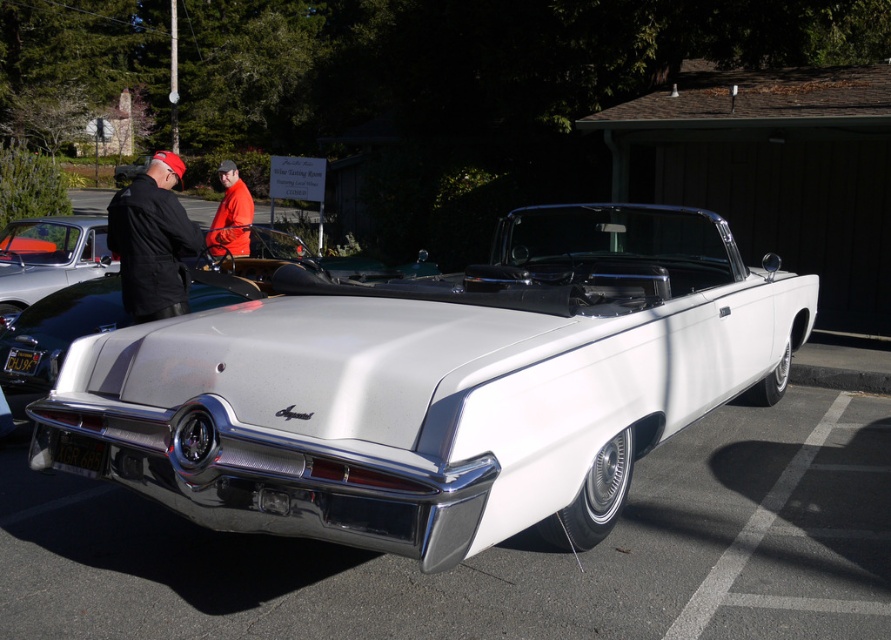
You are a photographer standing at the camera position. You want to take a photo of the black leather jacket at left without moving the car. Is it possible to capture the jacket in the frame while keeping the convertible car in the shot?

The black leather jacket at left is 17.29 feet away from the camera. Since the jacket is positioned at that distance and the car is parked in the foreground, it should be possible to include both the jacket and the convertible car in the same frame by adjusting the camera angle or zoom level appropriately.